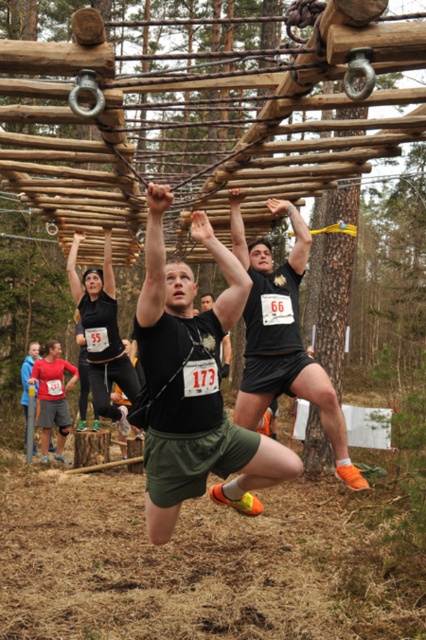
Question: Is black matte shirt at center bigger than matte black shorts at center?

Choices:
 (A) no
 (B) yes

Answer: (B)

Question: Among these points, which one is nearest to the camera?

Choices:
 (A) (282, 200)
 (B) (161, 492)

Answer: (B)

Question: Which point is closer to the camera?

Choices:
 (A) black matte shirt at center
 (B) matte black shorts at center

Answer: (A)

Question: In this image, where is black matte shirt at center located relative to matte black shorts at center?

Choices:
 (A) right
 (B) left

Answer: (B)

Question: Where is black matte shirt at center located in relation to matte black shorts at center in the image?

Choices:
 (A) right
 (B) left

Answer: (B)